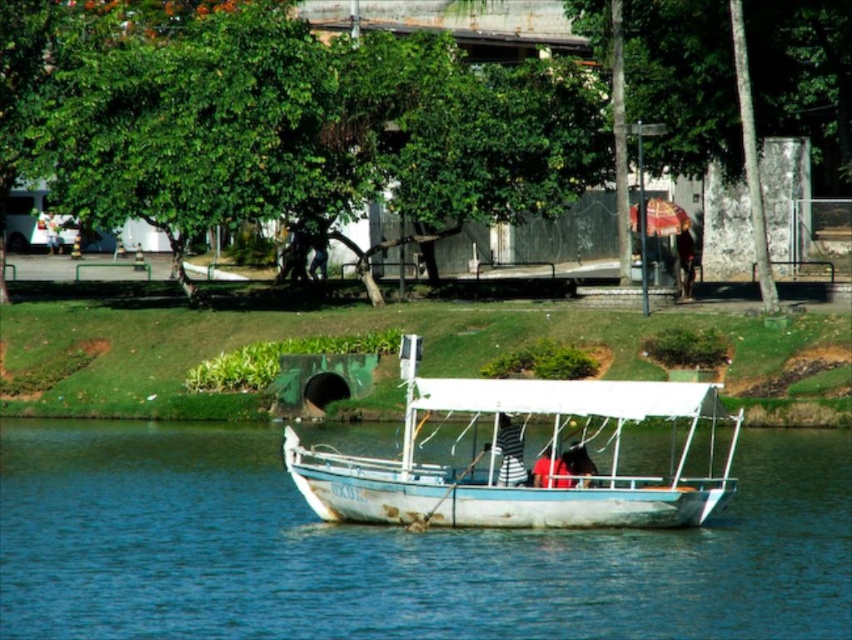
Question: Which point is closer to the camera?

Choices:
 (A) (616, 477)
 (B) (3, 604)

Answer: (B)

Question: Can you confirm if red fabric shirt at center is wider than dark brown leather jacket at center?

Choices:
 (A) yes
 (B) no

Answer: (A)

Question: Does green leafy tree at center lie in front of blue wooden boat at center?

Choices:
 (A) yes
 (B) no

Answer: (B)

Question: Which object appears farthest from the camera in this image?

Choices:
 (A) blue wooden boat at center
 (B) white matte boat at center
 (C) striped fabric shirt at center
 (D) white fabric umbrella at center

Answer: (D)

Question: Is red fabric shirt at center positioned in front of white fabric umbrella at center?

Choices:
 (A) yes
 (B) no

Answer: (A)

Question: Estimate the real-world distances between objects in this image. Which object is closer to the white matte boat at center?

Choices:
 (A) red fabric shirt at center
 (B) dark brown leather jacket at center
 (C) blue wooden boat at center

Answer: (C)